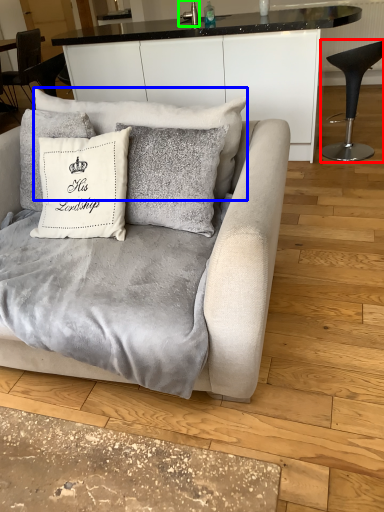
Question: Estimate the real-world distances between objects in this image. Which object is farther from chair (highlighted by a red box), pillow (highlighted by a blue box) or silver (highlighted by a green box)?

Choices:
 (A) pillow
 (B) silver

Answer: (A)